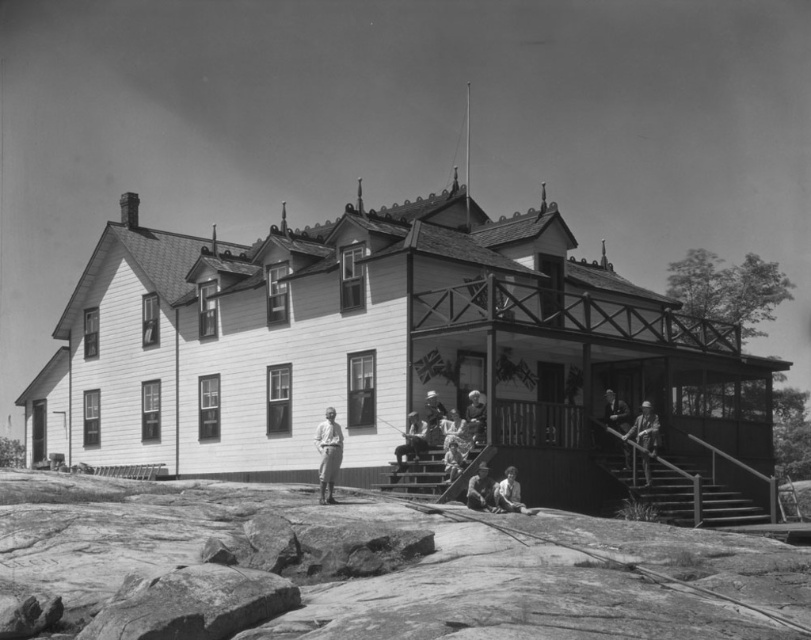
Question: Among these points, which one is nearest to the camera?

Choices:
 (A) (719, 518)
 (B) (316, 433)
 (C) (624, 417)

Answer: (B)

Question: Is smooth leather jacket at lower center smaller than smooth skin person at lower right?

Choices:
 (A) yes
 (B) no

Answer: (B)

Question: Which point is farther from the camera taking this photo?

Choices:
 (A) (629, 417)
 (B) (475, 435)

Answer: (A)

Question: Is wooden stairs at center positioned in front of wooden helmet at center?

Choices:
 (A) no
 (B) yes

Answer: (B)

Question: Is wooden helmet at center positioned before smooth gray shirt at center?

Choices:
 (A) yes
 (B) no

Answer: (A)

Question: Which point is closer to the camera taking this photo?

Choices:
 (A) (517, 512)
 (B) (704, 515)

Answer: (A)